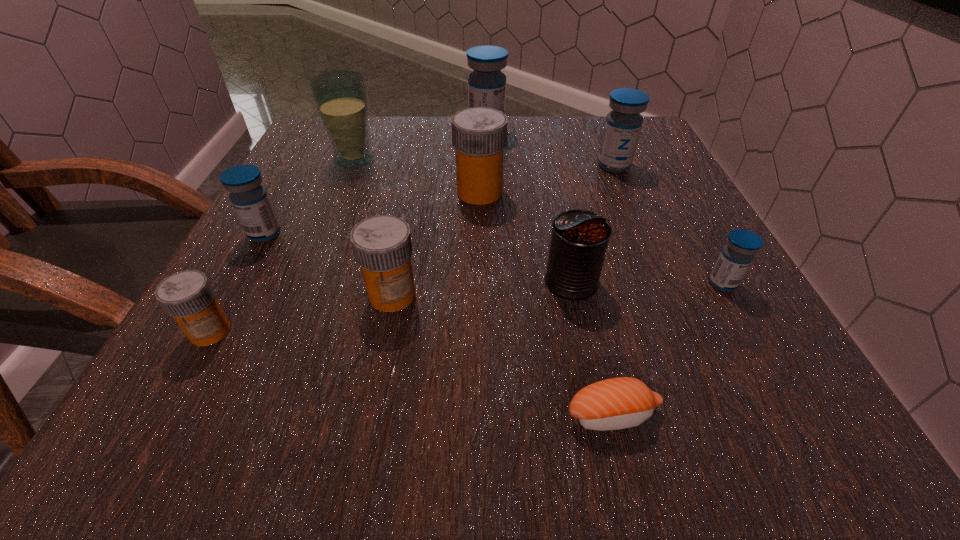
Where is `free space located on the front of the glass`? The image size is (960, 540). free space located on the front of the glass is located at coordinates (344, 186).

Find the location of a particular element. free space located 0.050m on the label side of the rightmost orange medicine is located at coordinates (530, 192).

Image resolution: width=960 pixels, height=540 pixels. Find the location of `vacant space located 0.140m on the front of the second medicine from right to left`. vacant space located 0.140m on the front of the second medicine from right to left is located at coordinates [635, 215].

Where is `vacant space located on the left of the can`? vacant space located on the left of the can is located at coordinates (448, 281).

The image size is (960, 540). What are the coordinates of `free space located 0.290m on the front of the third farthest blue medicine` in the screenshot? It's located at (174, 395).

Where is `free point located on the label side of the second biggest orange medicine`? The width and height of the screenshot is (960, 540). free point located on the label side of the second biggest orange medicine is located at coordinates (374, 386).

Locate an element on the screen. The image size is (960, 540). free space located on the left of the rightmost blue medicine is located at coordinates (669, 284).

At what (x,y) coordinates should I click in order to perform the action: click on vacant space located 0.080m on the label side of the smallest orange medicine. Please return your answer as a coordinate pair (x, y). The image size is (960, 540). Looking at the image, I should click on pos(171,401).

At what (x,y) coordinates should I click in order to perform the action: click on free space located 0.330m on the back of the nearest object. Please return your answer as a coordinate pair (x, y). The height and width of the screenshot is (540, 960). Looking at the image, I should click on (569, 230).

Where is `glass located at the far edge`? The height and width of the screenshot is (540, 960). glass located at the far edge is located at coordinates (340, 96).